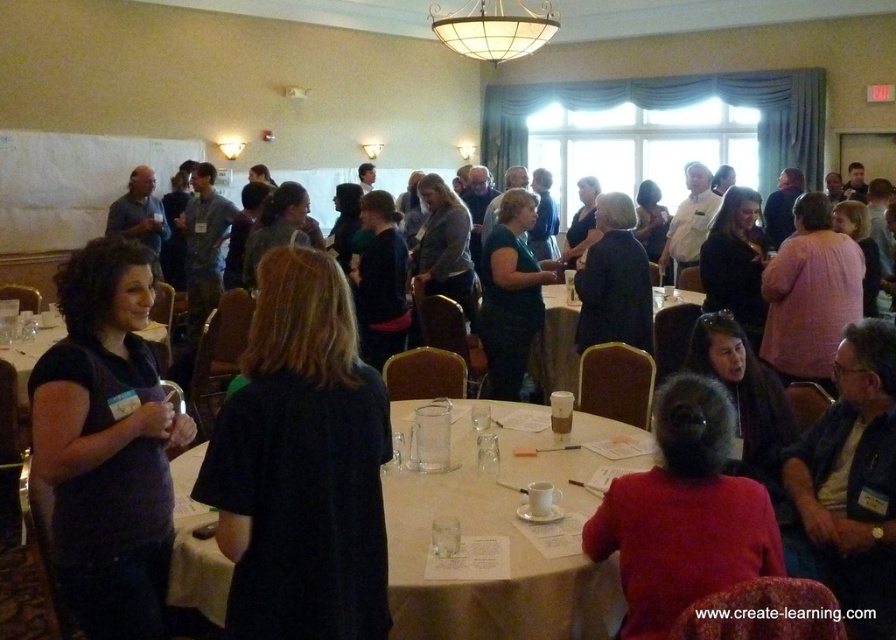
Does red matte sweater at lower right appear under translucent plastic cup at center?

Yes, red matte sweater at lower right is below translucent plastic cup at center.

Can you confirm if red matte sweater at lower right is positioned above translucent plastic cup at center?

No, red matte sweater at lower right is not above translucent plastic cup at center.

Is point (720, 506) less distant than point (564, 292)?

Yes, it is in front of point (564, 292).

Find the location of a particular element. The width and height of the screenshot is (896, 640). red matte sweater at lower right is located at coordinates (685, 513).

Is point (213, 588) farther from camera compared to point (33, 346)?

No.

Can you confirm if beige fabric table at center is shorter than matte black table at lower left?

Incorrect, beige fabric table at center's height does not fall short of matte black table at lower left's.

Measure the distance between point (x=502, y=420) and camera.

The distance of point (x=502, y=420) from camera is 2.86 meters.

The width and height of the screenshot is (896, 640). Identify the location of beige fabric table at center. (507, 532).

From the picture: Can you confirm if black matte shirt at center is shorter than green matte shirt at center?

Yes.

Does black matte shirt at center have a larger size compared to green matte shirt at center?

Actually, black matte shirt at center might be smaller than green matte shirt at center.

The image size is (896, 640). What do you see at coordinates (300, 465) in the screenshot? I see `black matte shirt at center` at bounding box center [300, 465].

Locate an element on the screen. The height and width of the screenshot is (640, 896). black matte shirt at center is located at coordinates (300, 465).